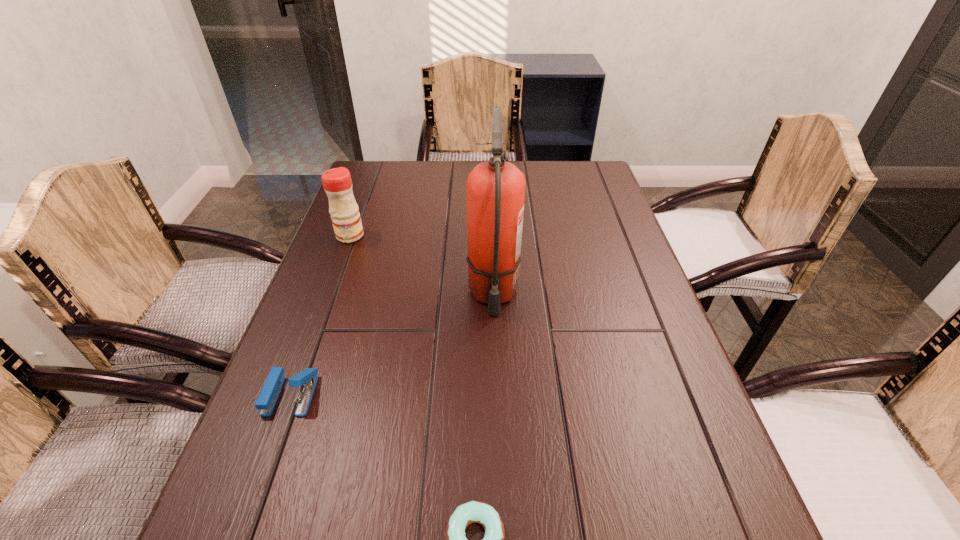
The width and height of the screenshot is (960, 540). I want to click on fire extinguisher, so click(495, 189).

The width and height of the screenshot is (960, 540). In order to click on the third nearest object in this screenshot , I will do `click(495, 189)`.

Locate an element on the screen. This screenshot has height=540, width=960. the second tallest object is located at coordinates click(x=346, y=220).

Locate an element on the screen. The width and height of the screenshot is (960, 540). the farthest object is located at coordinates (346, 220).

Find the location of a particular element. the second shortest object is located at coordinates (307, 379).

This screenshot has height=540, width=960. In order to click on the third farthest object in this screenshot , I will do [307, 379].

You are a GUI agent. You are given a task and a screenshot of the screen. Output one action in this format:
    pyautogui.click(x=<x>, y=<y>)
    Task: Click on the free space located 0.380m on the nozzle of the tallest object
    The image size is (960, 540).
    Given the screenshot: What is the action you would take?
    pyautogui.click(x=499, y=500)

Find the location of a particular element. This screenshot has height=540, width=960. vacant space located 0.320m on the front of the condiment is located at coordinates (315, 332).

Where is `free spot located on the right of the second shortest object`? Image resolution: width=960 pixels, height=540 pixels. free spot located on the right of the second shortest object is located at coordinates (518, 395).

Locate an element on the screen. The height and width of the screenshot is (540, 960). condiment at the left edge is located at coordinates (346, 220).